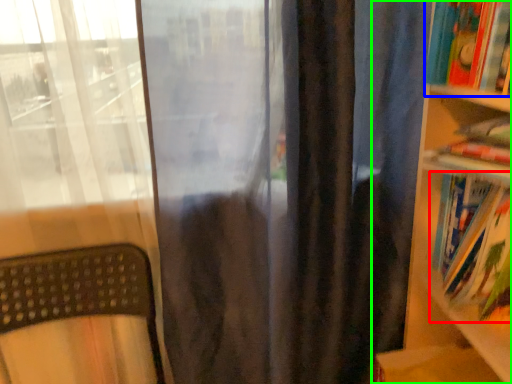
Question: Which is farther away from book (highlighted by a red box)? book (highlighted by a blue box) or bookcase (highlighted by a green box)?

Choices:
 (A) book
 (B) bookcase

Answer: (A)